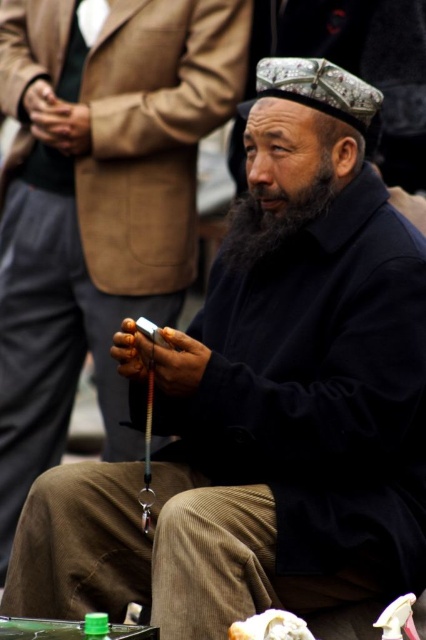
Question: Can you confirm if black fuzzy beard at center is smaller than white fluffy bread at lower center?

Choices:
 (A) no
 (B) yes

Answer: (A)

Question: Does black fuzzy beard at center have a lesser width compared to white fluffy bread at lower center?

Choices:
 (A) yes
 (B) no

Answer: (B)

Question: Which point is closer to the camera?

Choices:
 (A) (244, 627)
 (B) (290, 204)

Answer: (A)

Question: Is black fuzzy beard at center further to camera compared to white fluffy bread at lower center?

Choices:
 (A) yes
 (B) no

Answer: (A)

Question: Which point appears closest to the camera in this image?

Choices:
 (A) [291, 209]
 (B) [230, 627]

Answer: (B)